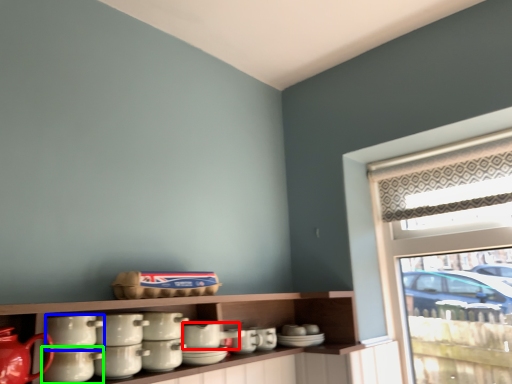
Question: Based on their relative distances, which object is nearer to tableware (highlighted by a red box)? Choose from tableware (highlighted by a blue box) and tableware (highlighted by a green box).

Choices:
 (A) tableware
 (B) tableware

Answer: (B)